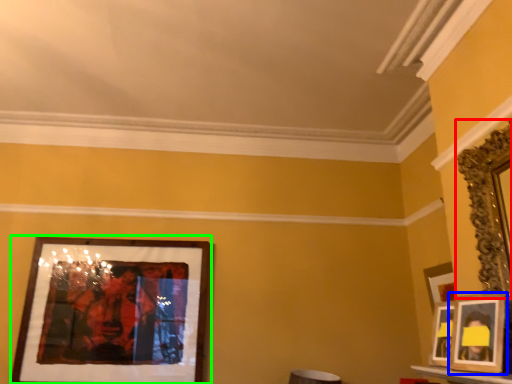
Question: Which is nearer to the picture frame (highlighted by a red box)? picture frame (highlighted by a blue box) or picture frame (highlighted by a green box).

Choices:
 (A) picture frame
 (B) picture frame

Answer: (A)